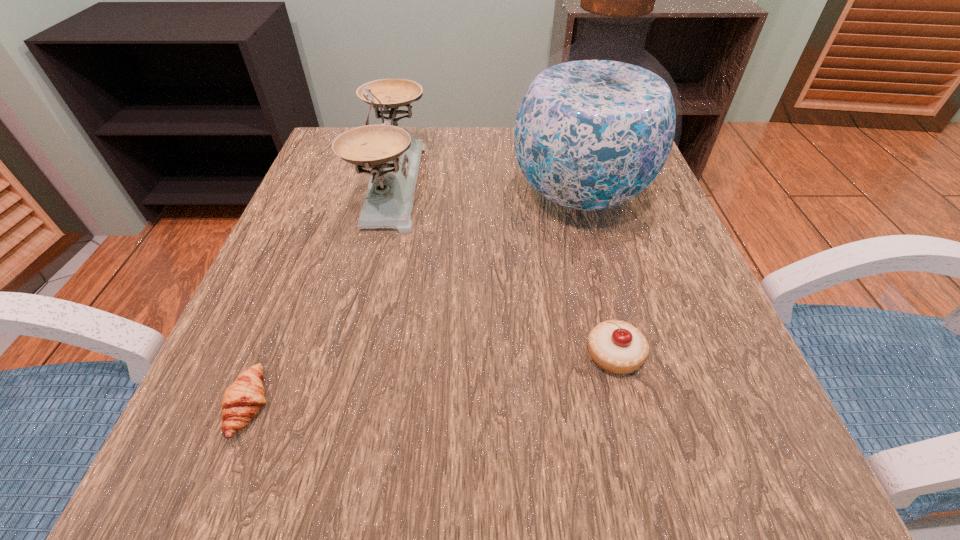
Where is `blank region between the shorter pastry and the water jug`? This screenshot has width=960, height=540. blank region between the shorter pastry and the water jug is located at coordinates (415, 300).

The height and width of the screenshot is (540, 960). I want to click on free spot between the second shortest object and the water jug, so click(x=597, y=275).

You are a GUI agent. You are given a task and a screenshot of the screen. Output one action in this format:
    pyautogui.click(x=<x>, y=<y>)
    Task: Click on the free space that is in between the third shortest object and the shortest object
    
    Given the screenshot: What is the action you would take?
    pyautogui.click(x=322, y=295)

Image resolution: width=960 pixels, height=540 pixels. I want to click on free space between the third object from right to left and the tallest object, so click(x=487, y=190).

Identify the location of blank region between the second object from left to right and the left pastry. (322, 295).

Find the location of a particular element. vacant space that's between the taller pastry and the third shortest object is located at coordinates (504, 269).

Identify the location of vacant area that lies between the right pastry and the tallest object. (597, 275).

The height and width of the screenshot is (540, 960). I want to click on empty space between the water jug and the leftmost object, so click(x=415, y=300).

Image resolution: width=960 pixels, height=540 pixels. In order to click on object that is the closest to the third shortest object in this screenshot , I will do `click(595, 127)`.

I want to click on the closest object to the water jug, so click(394, 155).